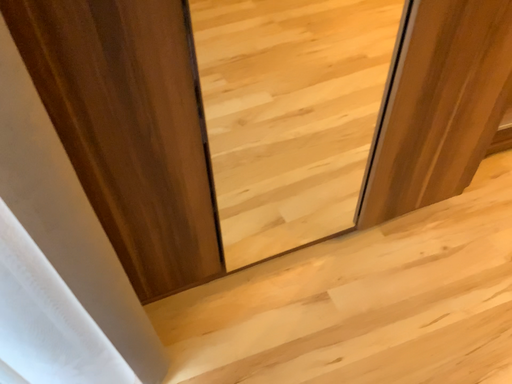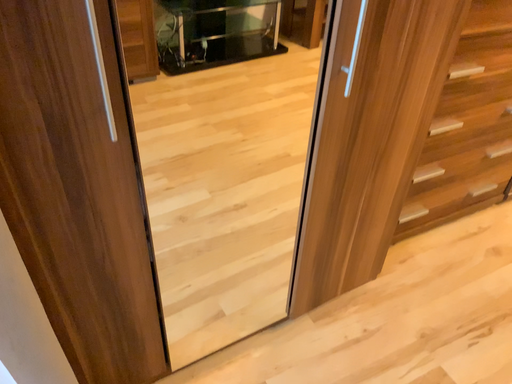
Question: Which way did the camera rotate in the video?

Choices:
 (A) rotated downward
 (B) rotated upward

Answer: (B)